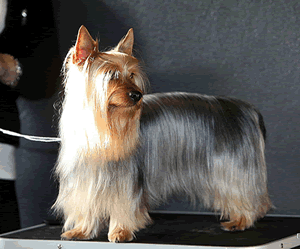
Identify the location of gray wall. Image resolution: width=300 pixels, height=250 pixels. (230, 67).